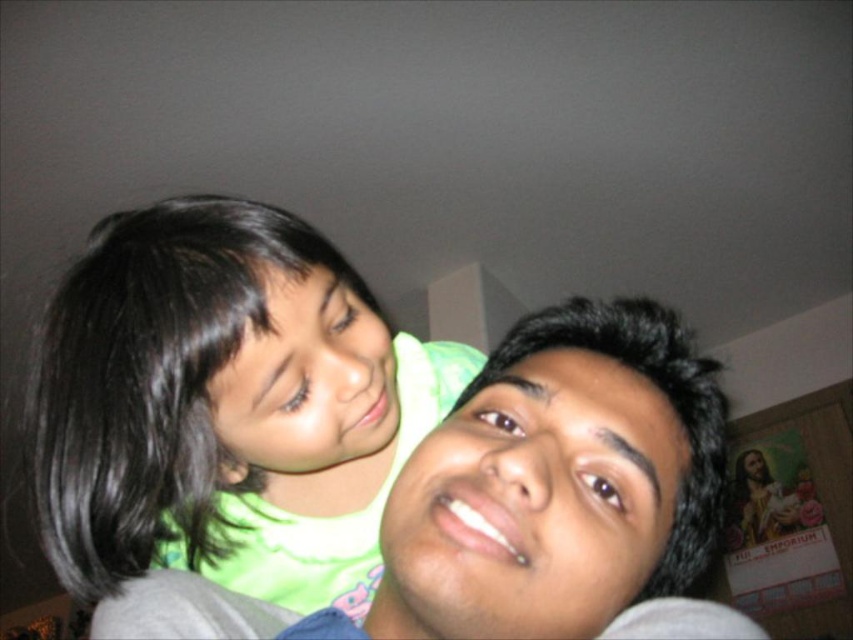
Question: Which point is closer to the camera?

Choices:
 (A) (329, 358)
 (B) (630, 548)

Answer: (B)

Question: Is green matte shirt at upper left closer to camera compared to matte gray shirt at center?

Choices:
 (A) yes
 (B) no

Answer: (B)

Question: Is green matte shirt at upper left above matte gray shirt at center?

Choices:
 (A) no
 (B) yes

Answer: (B)

Question: Among these points, which one is nearest to the camera?

Choices:
 (A) (403, 531)
 (B) (248, 300)

Answer: (A)

Question: Does green matte shirt at upper left have a greater width compared to matte gray shirt at center?

Choices:
 (A) yes
 (B) no

Answer: (B)

Question: Among these points, which one is nearest to the camera?

Choices:
 (A) (711, 440)
 (B) (109, 234)

Answer: (A)